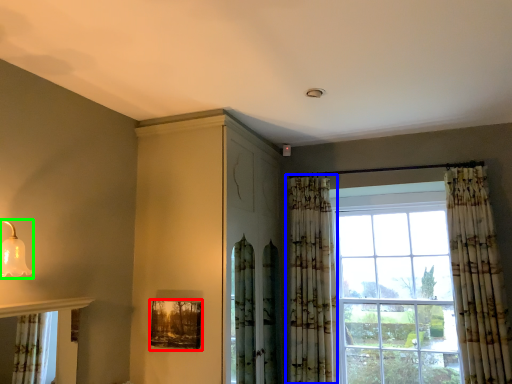
Question: Considering the real-world distances, which object is closest to picture frame (highlighted by a red box)? curtain (highlighted by a blue box) or light fixture (highlighted by a green box).

Choices:
 (A) curtain
 (B) light fixture

Answer: (B)